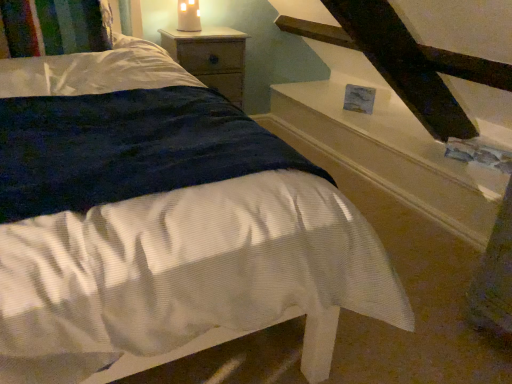
Where is `empty space that is ontop of wooden nightstand at upper center (from a real-world perspective)`? The image size is (512, 384). empty space that is ontop of wooden nightstand at upper center (from a real-world perspective) is located at coordinates (203, 37).